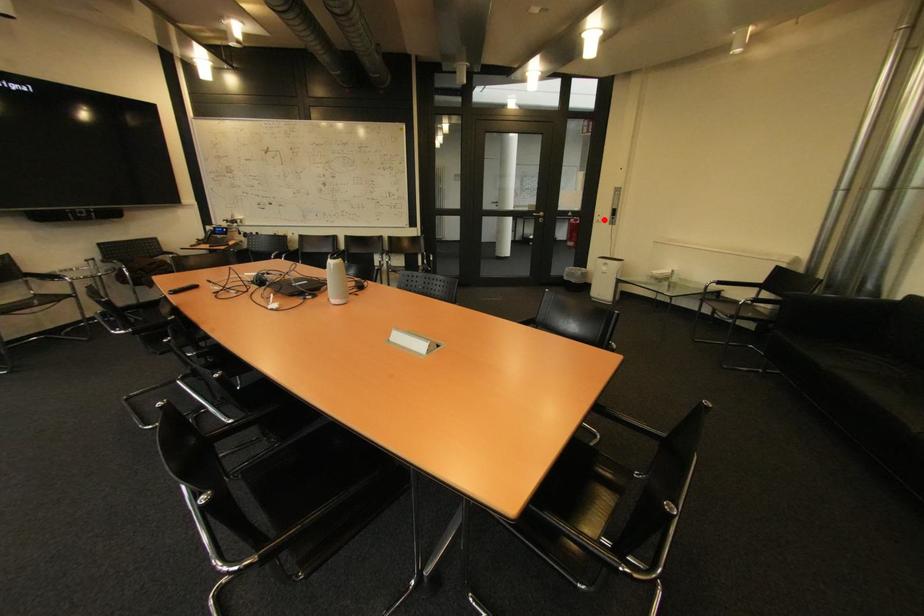
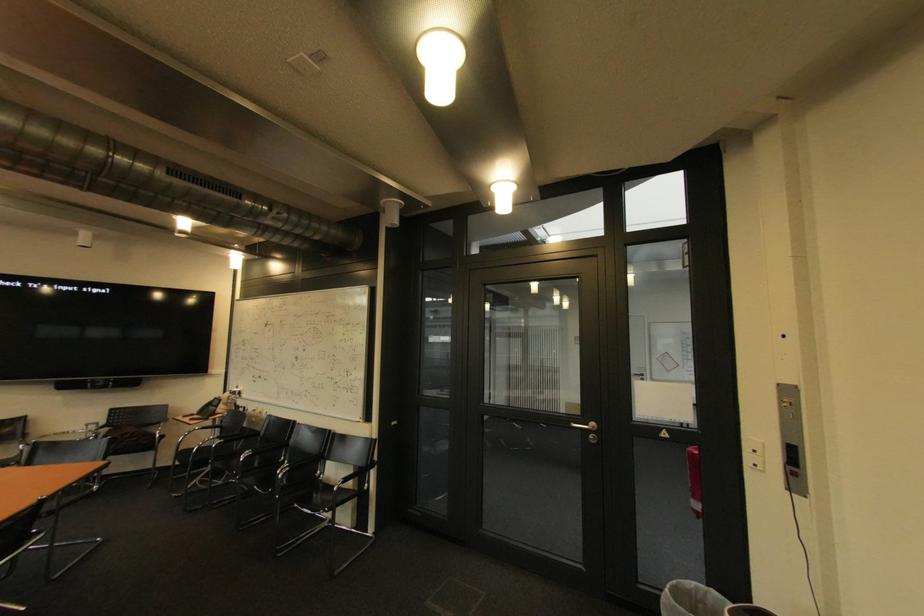
The point at the highlighted location is marked in the first image. Where is the corresponding point in the second image?

(757, 459)